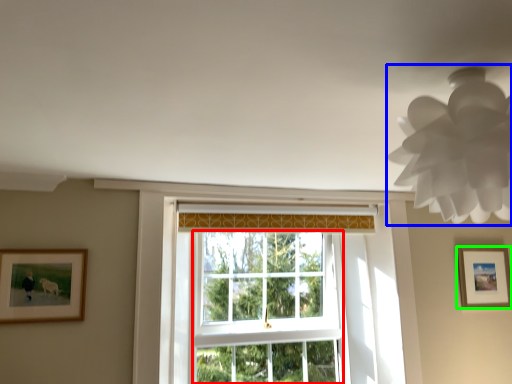
Question: Which object is the closest to the bay window (highlighted by a red box)? Choose among these: lamp (highlighted by a blue box) or picture frame (highlighted by a green box).

Choices:
 (A) lamp
 (B) picture frame

Answer: (B)